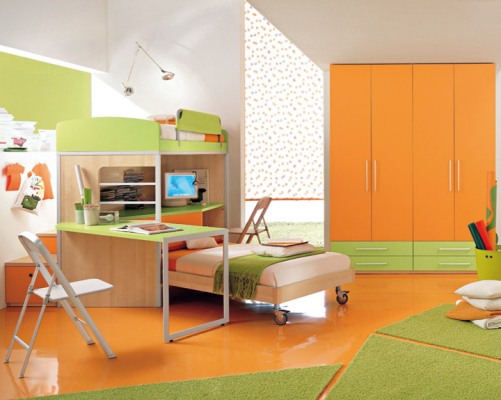
I want to click on light green mat, so click(427, 317), click(417, 386), click(307, 390).